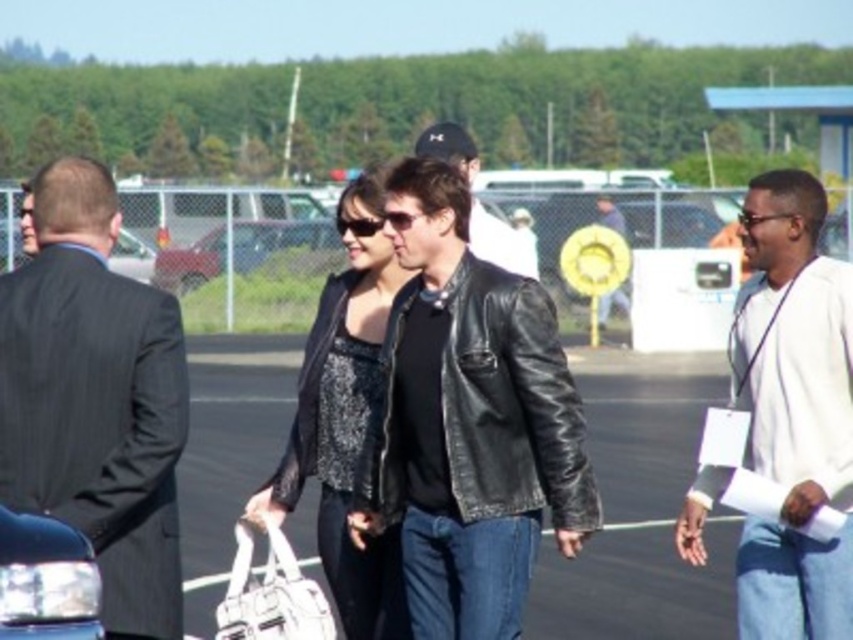
Question: Which is farther from the dark gray pinstripe suit at left?

Choices:
 (A) leather jacket at center
 (B) white fabric bag at center

Answer: (A)

Question: Which point appears closest to the camera in this image?

Choices:
 (A) (842, 536)
 (B) (82, 164)
 (C) (587, 460)

Answer: (B)

Question: Is white cotton shirt at right wider than sparkly black dress at center?

Choices:
 (A) no
 (B) yes

Answer: (A)

Question: Which point is closer to the camera?

Choices:
 (A) white fabric bag at center
 (B) metallic red car at center

Answer: (A)

Question: Does white cotton shirt at right appear on the right side of sparkly black dress at center?

Choices:
 (A) no
 (B) yes

Answer: (B)

Question: In this image, where is sparkly black dress at center located relative to metallic red car at center?

Choices:
 (A) below
 (B) above

Answer: (A)